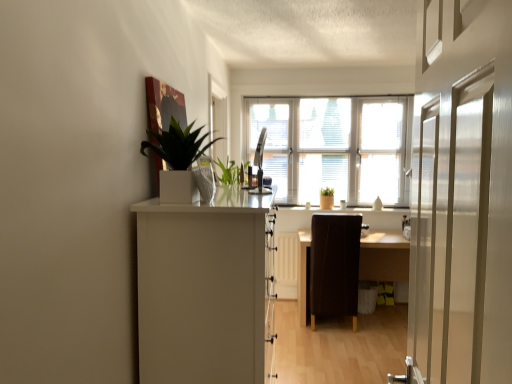
Describe the element at coordinates (260, 164) in the screenshot. The image size is (512, 384). I see `metallic silver monitor at center` at that location.

This screenshot has width=512, height=384. What do you see at coordinates (178, 145) in the screenshot?
I see `green matte plant at upper left` at bounding box center [178, 145].

What is the approximate height of wooden table at center?

The height of wooden table at center is 29.97 inches.

Locate an element on the screen. brown leather chair at center is located at coordinates (334, 266).

Consider the image. Between brown leather chair at center and metallic silver monitor at center, which one has smaller width?

With smaller width is metallic silver monitor at center.

Is brown leather chair at center at the right side of metallic silver monitor at center?

Yes.

Which object is further away from the camera, brown leather chair at center or metallic silver monitor at center?

Positioned behind is brown leather chair at center.

From a real-world perspective, is brown leather chair at center on metallic silver monitor at center?

Actually, brown leather chair at center is physically below metallic silver monitor at center in the real world.

Does brown leather chair at center turn towards white matte cabinet at left?

No, brown leather chair at center is not turned towards white matte cabinet at left.

Considering the positions of objects brown leather chair at center and white matte cabinet at left in the image provided, who is more to the left, brown leather chair at center or white matte cabinet at left?

From the viewer's perspective, white matte cabinet at left appears more on the left side.

Is brown leather chair at center smaller than white matte cabinet at left?

Indeed, brown leather chair at center has a smaller size compared to white matte cabinet at left.

Is white matte cabinet at left a part of brown leather chair at center?

No, white matte cabinet at left is not surrounded by brown leather chair at center.

From the image's perspective, is white glossy door at right on metallic silver monitor at center?

No.

Is white glossy door at right positioned with its back to metallic silver monitor at center?

No, metallic silver monitor at center is not at the back of white glossy door at right.

Does point (474, 146) lie behind point (258, 159)?

No.

Identify the location of door to the right of metallic silver monitor at center. (462, 195).

Can you confirm if white matte cabinet at left is positioned to the left of wooden table at center?

Yes, white matte cabinet at left is to the left of wooden table at center.

Is white matte cabinet at left taller or shorter than wooden table at center?

Clearly, white matte cabinet at left is taller compared to wooden table at center.

Relative to wooden table at center, is white matte cabinet at left in front or behind?

white matte cabinet at left is in front of wooden table at center.

Is point (198, 304) farther from viewer compared to point (406, 280)?

No, it is in front of (406, 280).

Is white matte cabinet at left to the left or to the right of metallic silver monitor at center in the image?

Based on their positions, white matte cabinet at left is located to the left of metallic silver monitor at center.

From a real-world perspective, who is located lower, white matte cabinet at left or metallic silver monitor at center?

white matte cabinet at left is physically lower.

From the image's perspective, which is below, white matte cabinet at left or metallic silver monitor at center?

white matte cabinet at left is shown below in the image.

I want to click on door lying in front of the brown leather chair at center, so click(x=462, y=195).

Between white glossy door at right and brown leather chair at center, which one has larger size?

With larger size is brown leather chair at center.

From the image's perspective, which one is positioned higher, white glossy door at right or brown leather chair at center?

white glossy door at right.

From the image's perspective, which one is positioned lower, wooden table at center or brown leather chair at center?

From the image's view, wooden table at center is below.

Is point (371, 257) behind point (355, 307)?

Yes, it is.

How many degrees apart are the facing directions of wooden table at center and brown leather chair at center?

wooden table at center and brown leather chair at center are facing 179 degrees away from each other.

Are wooden table at center and brown leather chair at center beside each other?

They are not placed beside each other.

At what (x,y) coordinates should I click in order to perform the action: click on silver that appears above the brown leather chair at center (from the image's perspective). Please return your answer as a coordinate pair (x, y). Image resolution: width=512 pixels, height=384 pixels. Looking at the image, I should click on (260, 164).

Identify the location of chair on the right side of white matte cabinet at left. (334, 266).

Which object lies further to the anchor point white glossy window at center, white matte cabinet at left or white glossy door at right?

white glossy door at right is positioned further to the anchor white glossy window at center.

When comparing their distances from white glossy door at right, does white glossy window at center or white matte cabinet at left seem closer?

Based on the image, white matte cabinet at left appears to be nearer to white glossy door at right.

Which object lies nearer to the anchor point white glossy window at center, green matte plant at upper left or white matte cabinet at left?

green matte plant at upper left.

Which object lies nearer to the anchor point brown leather chair at center, white glossy window at center or wooden table at center?

Based on the image, wooden table at center appears to be nearer to brown leather chair at center.

In the scene shown: Which object lies nearer to the anchor point white glossy window at center, brown leather chair at center or metallic silver monitor at center?

metallic silver monitor at center lies closer to white glossy window at center than the other object.

Considering their positions, is white glossy door at right positioned further to brown leather chair at center than white glossy window at center?

white glossy door at right is further to brown leather chair at center.

Looking at the image, which one is located closer to white glossy door at right, brown leather chair at center or wooden table at center?

brown leather chair at center is positioned closer to the anchor white glossy door at right.

In the scene shown: Looking at the image, which one is located further to metallic silver monitor at center, green matte plant at upper left or brown leather chair at center?

green matte plant at upper left.

Find the location of `chair between white glossy door at right and white glossy window at center from front to back`. chair between white glossy door at right and white glossy window at center from front to back is located at coordinates (334, 266).

Find the location of a particular element. cabinetry between white glossy door at right and wooden table at center along the z-axis is located at coordinates (203, 286).

This screenshot has width=512, height=384. I want to click on chair positioned between metallic silver monitor at center and wooden table at center from near to far, so click(334, 266).

Find the location of a particular element. This screenshot has height=384, width=512. silver located between white glossy door at right and wooden table at center in the depth direction is located at coordinates (260, 164).